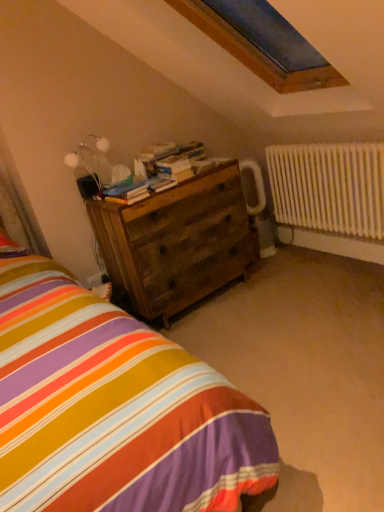
Question: From the image's perspective, relative to wooden books at center, the 2th book positioned from the bottom, is white painted metal radiator at right above or below?

Choices:
 (A) below
 (B) above

Answer: (A)

Question: From a real-world perspective, is white painted metal radiator at right positioned above or below wooden books at center, the 1th book viewed from the back?

Choices:
 (A) below
 (B) above

Answer: (A)

Question: Based on their relative distances, which object is farther from the striped fabric bed at lower left?

Choices:
 (A) wooden chest of drawers at center
 (B) white painted metal radiator at right
 (C) wooden books at center, the 1th book viewed from the back
 (D) wooden books at center, which ranks as the second book in back-to-front order
 (E) metallic silver table lamp at upper left

Answer: (B)

Question: Which object is positioned farthest from the metallic silver table lamp at upper left?

Choices:
 (A) wooden books at center, the 1th book positioned from the bottom
 (B) white painted metal radiator at right
 (C) striped fabric bed at lower left
 (D) wooden books at center, the 2th book positioned from the bottom
 (E) wooden chest of drawers at center

Answer: (B)